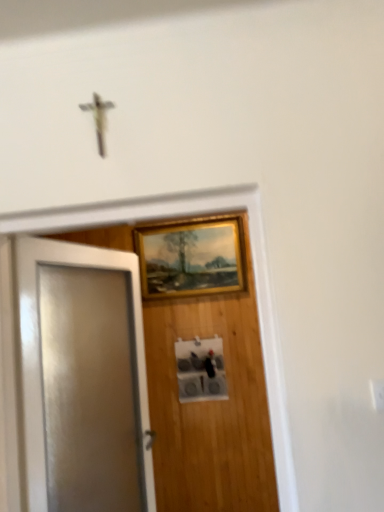
Where is `white glossy door at left`? This screenshot has width=384, height=512. white glossy door at left is located at coordinates (83, 378).

The width and height of the screenshot is (384, 512). Describe the element at coordinates (83, 378) in the screenshot. I see `white glossy door at left` at that location.

This screenshot has height=512, width=384. What do you see at coordinates (190, 258) in the screenshot?
I see `gold/gilded picture frame at upper center` at bounding box center [190, 258].

Measure the distance between gold/gilded picture frame at upper center and camera.

The distance of gold/gilded picture frame at upper center from camera is 9.89 feet.

You are a GUI agent. You are given a task and a screenshot of the screen. Output one action in this format:
    pyautogui.click(x=<x>, y=<y>)
    Task: Click on the gold/gilded picture frame at upper center
    The image size is (384, 512).
    Given the screenshot: What is the action you would take?
    point(190,258)

This screenshot has height=512, width=384. Identify the location of white glossy door at left. (83, 378).

Is white glossy door at left at the left side of gold/gilded picture frame at upper center?

Indeed, white glossy door at left is positioned on the left side of gold/gilded picture frame at upper center.

Relative to gold/gilded picture frame at upper center, is white glossy door at left in front or behind?

white glossy door at left is in front of gold/gilded picture frame at upper center.

Which is less distant, (52, 430) or (134, 229)?

Point (52, 430) is closer to the camera than point (134, 229).

From the image's perspective, which one is positioned higher, white glossy door at left or gold/gilded picture frame at upper center?

gold/gilded picture frame at upper center appears higher in the image.

From a real-world perspective, which object rests below the other?

In real-world perspective, white glossy door at left is lower.

Considering the relative sizes of white glossy door at left and gold/gilded picture frame at upper center in the image provided, is white glossy door at left thinner than gold/gilded picture frame at upper center?

Incorrect, the width of white glossy door at left is not less than that of gold/gilded picture frame at upper center.

From their relative heights in the image, would you say white glossy door at left is taller or shorter than gold/gilded picture frame at upper center?

In the image, white glossy door at left appears to be taller than gold/gilded picture frame at upper center.

Based on their sizes in the image, would you say white glossy door at left is bigger or smaller than gold/gilded picture frame at upper center?

In the image, white glossy door at left appears to be larger than gold/gilded picture frame at upper center.

Is gold/gilded picture frame at upper center a part of white glossy door at left?

No.

Is white glossy door at left not near gold/gilded picture frame at upper center?

Indeed, white glossy door at left is not near gold/gilded picture frame at upper center.

Is white glossy door at left aimed at gold/gilded picture frame at upper center?

No, white glossy door at left is not turned towards gold/gilded picture frame at upper center.

How many degrees apart are the facing directions of white glossy door at left and gold/gilded picture frame at upper center?

73.3 degrees.

Find the location of `door lying below the gold/gilded picture frame at upper center (from the image's perspective)`. door lying below the gold/gilded picture frame at upper center (from the image's perspective) is located at coordinates (83, 378).

Considering the positions of objects gold/gilded picture frame at upper center and white glossy door at left in the image provided, who is more to the left, gold/gilded picture frame at upper center or white glossy door at left?

Positioned to the left is white glossy door at left.

Is the position of gold/gilded picture frame at upper center more distant than that of white glossy door at left?

Yes, gold/gilded picture frame at upper center is behind white glossy door at left.

Is point (244, 280) positioned before point (37, 462)?

No, it is behind (37, 462).

Consider the image. From the image's perspective, is gold/gilded picture frame at upper center above or below white glossy door at left?

Based on their image positions, gold/gilded picture frame at upper center is located above white glossy door at left.

From a real-world perspective, relative to white glossy door at left, is gold/gilded picture frame at upper center vertically above or below?

gold/gilded picture frame at upper center is situated higher than white glossy door at left in the real world.

Considering the relative sizes of gold/gilded picture frame at upper center and white glossy door at left in the image provided, is gold/gilded picture frame at upper center thinner than white glossy door at left?

Yes.

Is gold/gilded picture frame at upper center taller or shorter than white glossy door at left?

Clearly, gold/gilded picture frame at upper center is shorter compared to white glossy door at left.

Based on the photo, considering the relative sizes of gold/gilded picture frame at upper center and white glossy door at left in the image provided, is gold/gilded picture frame at upper center bigger than white glossy door at left?

No, gold/gilded picture frame at upper center is not bigger than white glossy door at left.

Is gold/gilded picture frame at upper center surrounding white glossy door at left?

No, white glossy door at left is not surrounded by gold/gilded picture frame at upper center.

In the scene shown: Is there a large distance between gold/gilded picture frame at upper center and white glossy door at left?

Yes.

Does gold/gilded picture frame at upper center turn towards white glossy door at left?

Yes, gold/gilded picture frame at upper center is turned towards white glossy door at left.

What's the angular difference between gold/gilded picture frame at upper center and white glossy door at left's facing directions?

The angle between the facing direction of gold/gilded picture frame at upper center and the facing direction of white glossy door at left is 73.3 degrees.

Identify the location of picture frame behind the white glossy door at left. (190, 258).

This screenshot has width=384, height=512. I want to click on door to the left of gold/gilded picture frame at upper center, so click(x=83, y=378).

Locate an element on the screen. picture frame positioned vertically above the white glossy door at left (from a real-world perspective) is located at coordinates (190, 258).